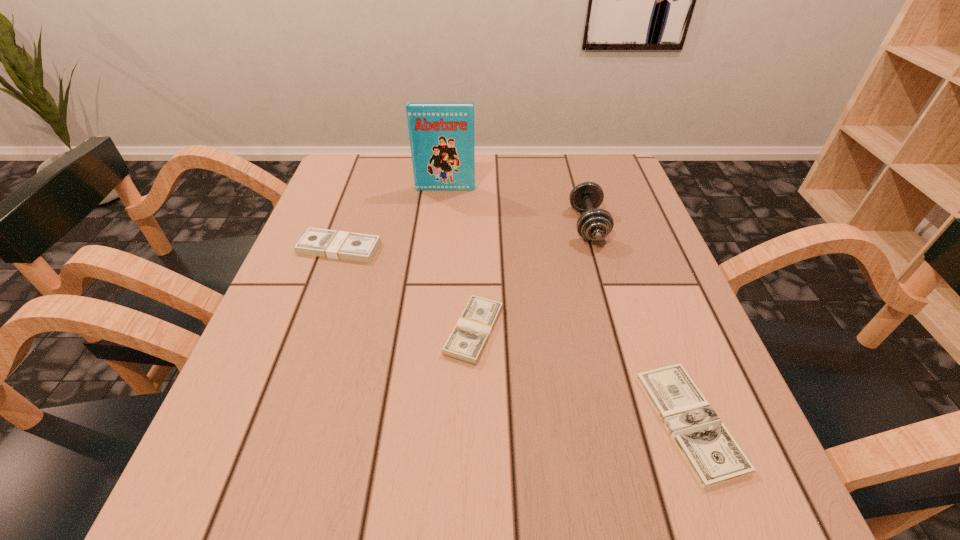
Select which dollar appears as the second closest to the farthest dollar. Please provide its 2D coordinates. Your answer should be formatted as a tuple, i.e. [(x, y)], where the tuple contains the x and y coordinates of a point satisfying the conditions above.

[(713, 455)]

Point out which dollar is positioned as the nearest to the leftmost dollar. Please provide its 2D coordinates. Your answer should be formatted as a tuple, i.e. [(x, y)], where the tuple contains the x and y coordinates of a point satisfying the conditions above.

[(469, 337)]

You are a GUI agent. You are given a task and a screenshot of the screen. Output one action in this format:
    pyautogui.click(x=<x>, y=<y>)
    Task: Click on the free space that satisfies the following two spatial constraints: 1. on the front cover of the shortest dollar; 2. on the right side of the book
    The height and width of the screenshot is (540, 960).
    Given the screenshot: What is the action you would take?
    pyautogui.click(x=421, y=422)

Identify the location of free space that satisfies the following two spatial constraints: 1. on the front cover of the book; 2. on the right side of the dumbbell. This screenshot has height=540, width=960. (442, 225).